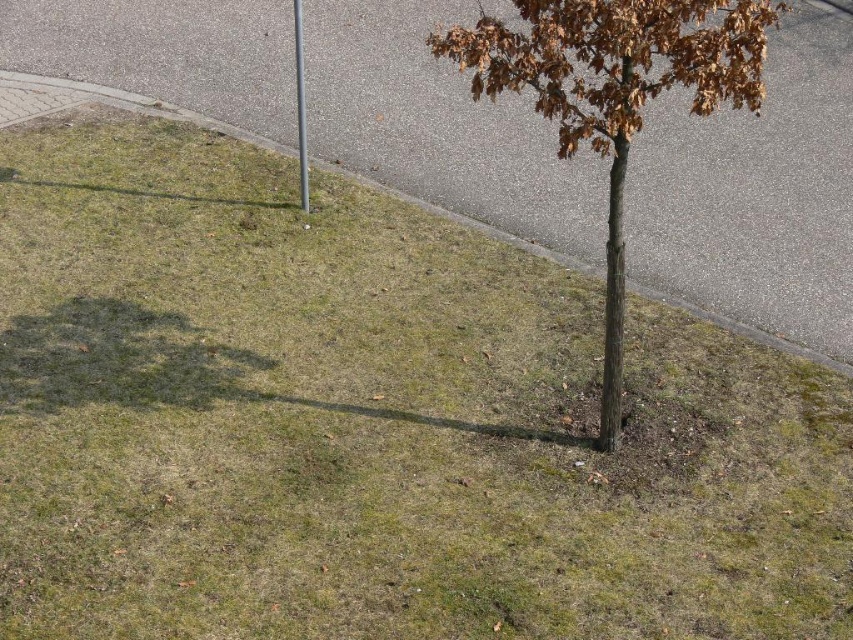
From the picture: Does brown rough bark tree at center lie in front of gray asphalt curb at lower left?

Yes, it is.

Which of these two, brown rough bark tree at center or gray asphalt curb at lower left, stands taller?

gray asphalt curb at lower left is taller.

Consider the image. Who is more distant from viewer, (561, 49) or (520, 243)?

The point (520, 243) is more distant.

This screenshot has width=853, height=640. In order to click on brown rough bark tree at center in this screenshot , I will do `click(614, 93)`.

Between point (680, 301) and point (305, 145), which one is positioned behind?

The point (305, 145) is behind.

Between gray asphalt curb at lower left and silver metallic pole at center, which one has more height?

gray asphalt curb at lower left is taller.

The height and width of the screenshot is (640, 853). Identify the location of gray asphalt curb at lower left. (102, 104).

Locate an element on the screen. gray asphalt curb at lower left is located at coordinates 102,104.

Is point (608, 280) more distant than point (300, 65)?

No, (608, 280) is in front of (300, 65).

Who is positioned more to the left, brown rough bark tree at center or silver metallic pole at center?

silver metallic pole at center is more to the left.

The height and width of the screenshot is (640, 853). What are the coordinates of `brown rough bark tree at center` in the screenshot? It's located at (614, 93).